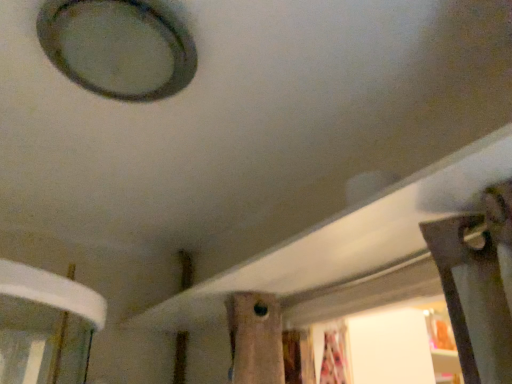
What are the coordinates of `matte gray hole at upper left` in the screenshot? It's located at (118, 46).

This screenshot has height=384, width=512. What do you see at coordinates (118, 46) in the screenshot?
I see `matte gray hole at upper left` at bounding box center [118, 46].

You are a GUI agent. You are given a task and a screenshot of the screen. Output one action in this format:
    pyautogui.click(x=<x>, y=<y>)
    Task: Click on the matte gray hole at upper left
    
    Given the screenshot: What is the action you would take?
    pyautogui.click(x=118, y=46)